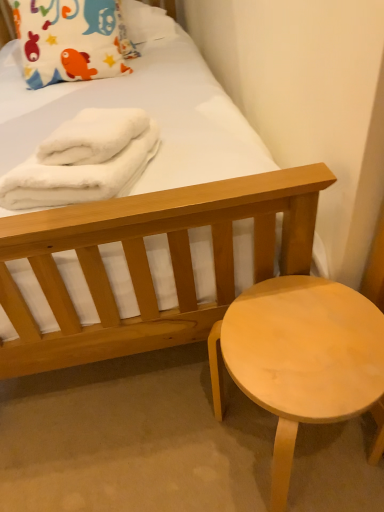
Question: Is light wood stool at lower right spatially inside white fluffy bath towel at upper left, marked as the 2th bath towel in a right-to-left arrangement, or outside of it?

Choices:
 (A) outside
 (B) inside

Answer: (A)

Question: From a real-world perspective, is light wood stool at lower right above or below white fluffy bath towel at upper left, marked as the 1th bath towel in a left-to-right arrangement?

Choices:
 (A) above
 (B) below

Answer: (B)

Question: Estimate the real-world distances between objects in this image. Which object is farther from the white fluffy towel at upper left, which ranks as the second bath towel in left-to-right order?

Choices:
 (A) light wood stool at lower right
 (B) white fluffy bath towel at upper left, marked as the 1th bath towel in a left-to-right arrangement
 (C) matte cotton pillow at upper left

Answer: (C)

Question: Which object is positioned closest to the white fluffy towel at upper left, which ranks as the first bath towel in right-to-left order?

Choices:
 (A) light wood stool at lower right
 (B) white fluffy bath towel at upper left, marked as the 2th bath towel in a right-to-left arrangement
 (C) matte cotton pillow at upper left

Answer: (B)